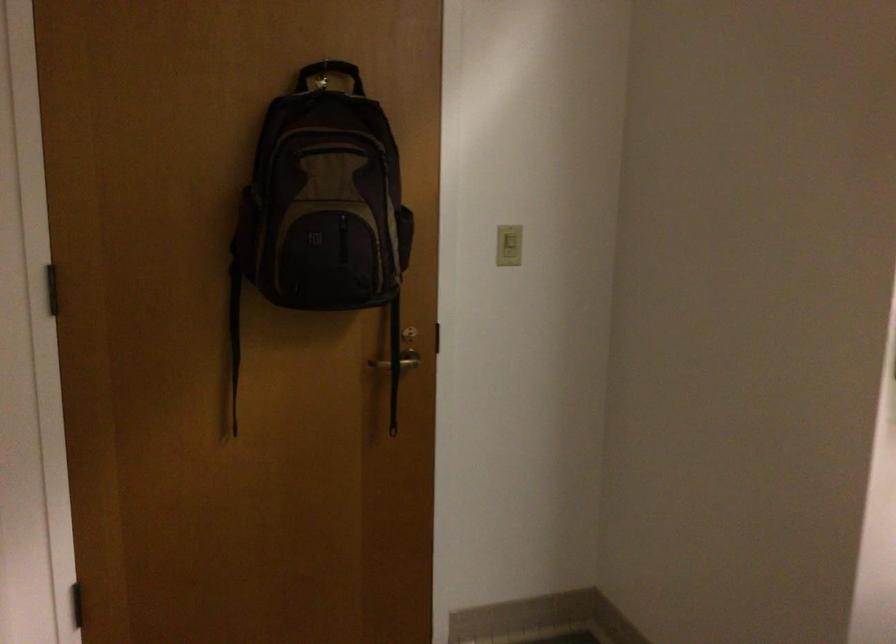
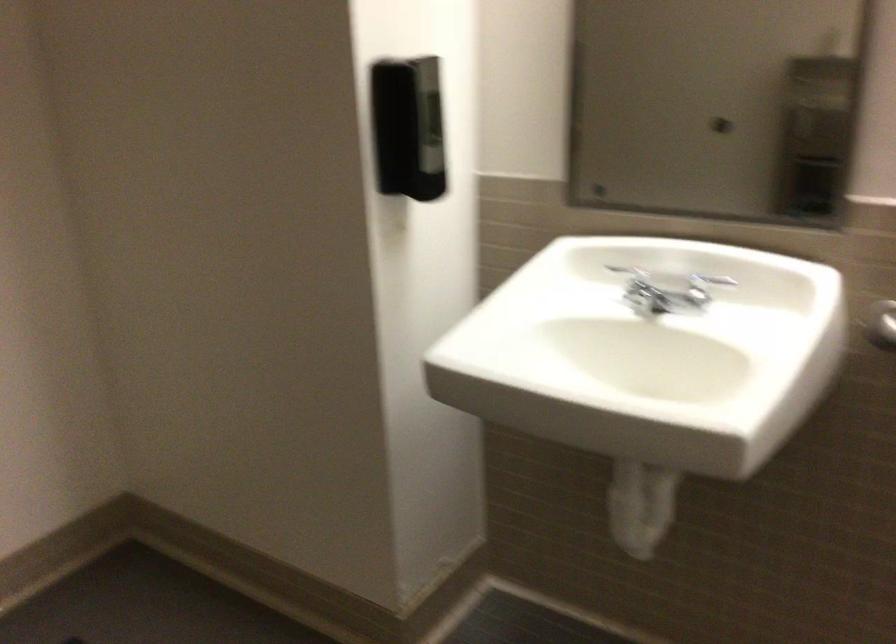
Question: The camera is either moving clockwise (left) or counter-clockwise (right) around the object. The first image is from the beginning of the video and the second image is from the end. Is the camera moving left or right when shooting the video?

Choices:
 (A) Left
 (B) Right

Answer: (A)